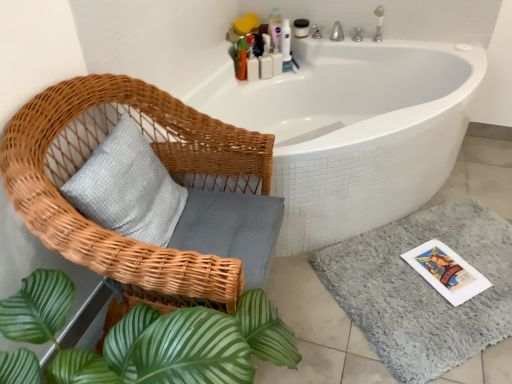
Find the location of a particular element. free space above gray shaggy bath mat at lower right (from a real-world perspective) is located at coordinates (437, 274).